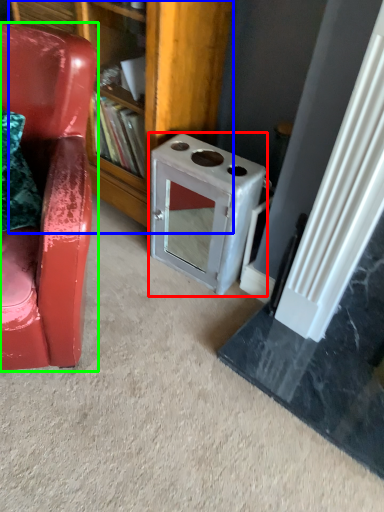
Question: Considering the real-world distances, which object is closest to appliance (highlighted by a red box)? bookshelf (highlighted by a blue box) or chair (highlighted by a green box).

Choices:
 (A) bookshelf
 (B) chair

Answer: (A)